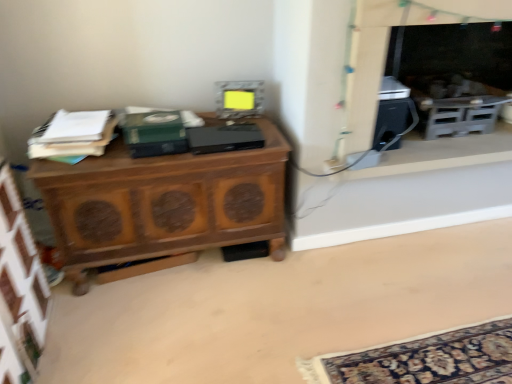
Question: Is black plastic speaker at right wider or thinner than matte black fireplace at upper right, the second fireplace from the back?

Choices:
 (A) thin
 (B) wide

Answer: (B)

Question: Considering the positions of point (436, 142) and point (415, 162), is point (436, 142) closer or farther from the camera than point (415, 162)?

Choices:
 (A) farther
 (B) closer

Answer: (A)

Question: Which of these objects is positioned farthest from the green matte book at center, the first book in the right-to-left sequence?

Choices:
 (A) white paper stack at left, which appears as the first book when viewed from the left
 (B) dark gray stone fireplace at upper right, positioned as the first fireplace in back-to-front order
 (C) matte gray microwave at center
 (D) wooden cabinet at left
 (E) wooden cabinet at lower left

Answer: (B)

Question: Which is nearer to the wooden cabinet at lower left?

Choices:
 (A) dark gray stone fireplace at upper right, the second fireplace in the front-to-back sequence
 (B) green matte book at center, which is the 2th book in left-to-right order
 (C) black plastic speaker at right
 (D) white paper stack at left, which appears as the first book when viewed from the left
 (E) wooden cabinet at left

Answer: (E)